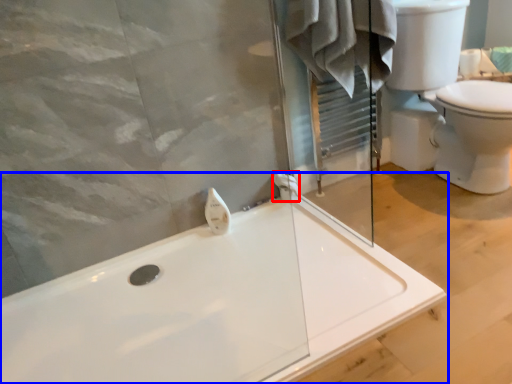
Question: Among these objects, which one is farthest to the camera, towel bar (highlighted by a red box) or bathtub (highlighted by a blue box)?

Choices:
 (A) towel bar
 (B) bathtub

Answer: (A)